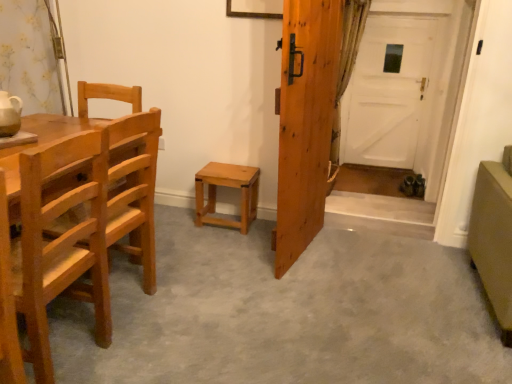
The image size is (512, 384). In order to click on free space to the left of light brown wood stool at center in this screenshot , I will do `click(177, 219)`.